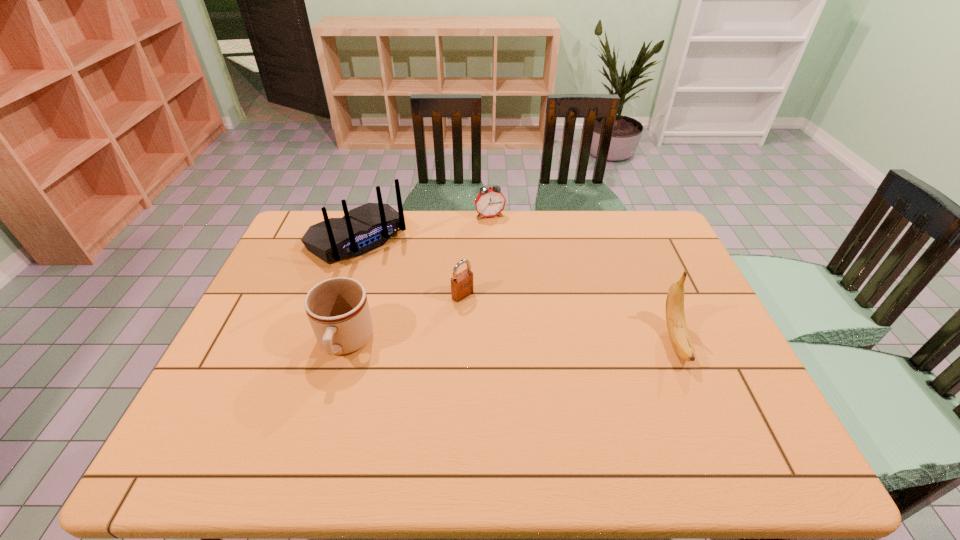
This screenshot has height=540, width=960. Identify the location of vacant area that lies between the banana and the router. (516, 290).

In order to click on free space between the router and the alarm clock in this screenshot , I will do `click(423, 227)`.

Locate an element on the screen. This screenshot has width=960, height=540. free space that is in between the rightmost object and the router is located at coordinates (516, 290).

This screenshot has height=540, width=960. In order to click on free spot between the padlock and the router in this screenshot , I will do `click(410, 267)`.

Where is `free spot between the third nearest object and the alarm clock`? The image size is (960, 540). free spot between the third nearest object and the alarm clock is located at coordinates (476, 255).

Locate an element on the screen. object that is the closest one to the router is located at coordinates (461, 284).

Where is `object that is the third closest to the router`? object that is the third closest to the router is located at coordinates (490, 202).

I want to click on free location that satisfies the following two spatial constraints: 1. on the back side of the padlock; 2. on the right side of the alarm clock, so click(x=466, y=216).